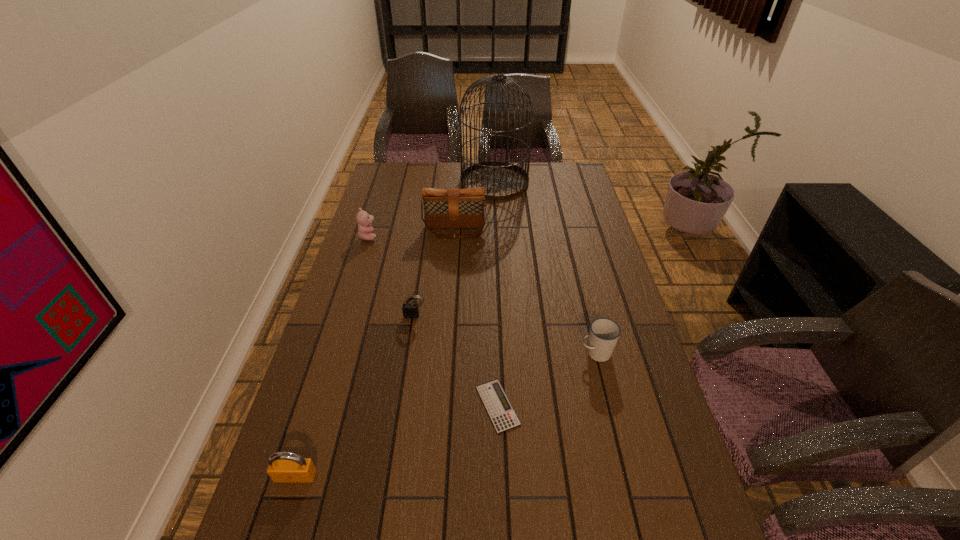
At what (x,y) coordinates should I click in order to perform the action: click on vacant area that lies between the taller padlock and the shoulder bag. Please return your answer as a coordinate pair (x, y). This screenshot has width=960, height=540. Looking at the image, I should click on (375, 353).

The width and height of the screenshot is (960, 540). In order to click on unoccupied area between the taller padlock and the teddy bear in this screenshot , I will do `click(332, 356)`.

In order to click on vacant area that lies between the tallest object and the rightmost object in this screenshot , I will do `click(545, 268)`.

Find the location of `free spot between the shoulder bag and the taller padlock`. free spot between the shoulder bag and the taller padlock is located at coordinates (375, 353).

Image resolution: width=960 pixels, height=540 pixels. I want to click on vacant area between the teddy bear and the taller padlock, so click(332, 356).

The image size is (960, 540). Identify the location of vacant point located between the cup and the teddy bear. (483, 295).

At what (x,y) coordinates should I click in order to perform the action: click on vacant area between the third nearest object and the nearest object. Please return your answer as a coordinate pair (x, y). Looking at the image, I should click on (445, 415).

Where is `free space between the shoulder bag and the farther padlock`? The width and height of the screenshot is (960, 540). free space between the shoulder bag and the farther padlock is located at coordinates (436, 273).

Identify which object is the sixth closest to the shoulder bag. Please provide its 2D coordinates. Your answer should be formatted as a tuple, i.e. [(x, y)], where the tuple contains the x and y coordinates of a point satisfying the conditions above.

[(284, 467)]

Identify which object is the fourth closest to the nearer padlock. Please provide its 2D coordinates. Your answer should be formatted as a tuple, i.e. [(x, y)], where the tuple contains the x and y coordinates of a point satisfying the conditions above.

[(365, 231)]